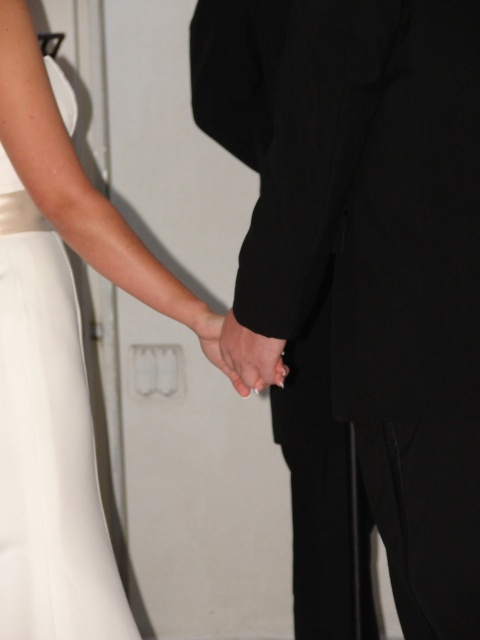
Question: Which of the following is the farthest from the observer?

Choices:
 (A) (94, 621)
 (B) (454, 579)

Answer: (A)

Question: Is black smooth suit at center closer to the viewer compared to smooth skin hand at center?

Choices:
 (A) yes
 (B) no

Answer: (A)

Question: Which is farther from the black smooth suit at center?

Choices:
 (A) smooth skin hand at center
 (B) white satin dress at left

Answer: (B)

Question: Which point is closer to the camera?

Choices:
 (A) black smooth suit at center
 (B) white satin dress at left
 (C) smooth skin hand at center

Answer: (A)

Question: Does white satin dress at left have a lesser width compared to smooth skin hand at center?

Choices:
 (A) yes
 (B) no

Answer: (B)

Question: Can you confirm if black smooth suit at center is positioned to the right of smooth skin hand at center?

Choices:
 (A) yes
 (B) no

Answer: (A)